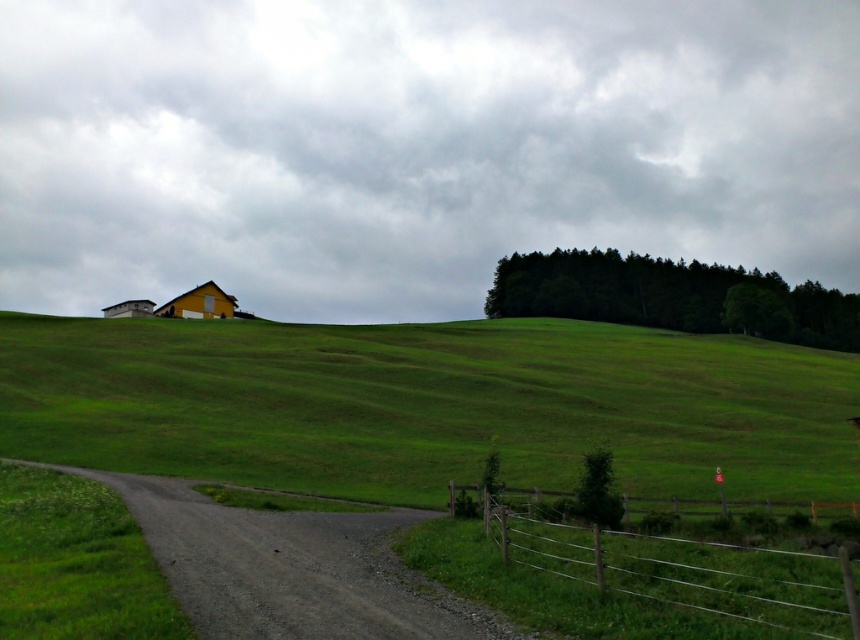
Which is more to the left, green grassy hillside at center or wooden fence at lower right?

green grassy hillside at center

Is green grassy hillside at center bigger than wooden fence at lower right?

Indeed, green grassy hillside at center has a larger size compared to wooden fence at lower right.

Is point (71, 444) closer to camera compared to point (680, 547)?

No, (71, 444) is further to viewer.

Locate an element on the screen. The height and width of the screenshot is (640, 860). green grassy hillside at center is located at coordinates (430, 404).